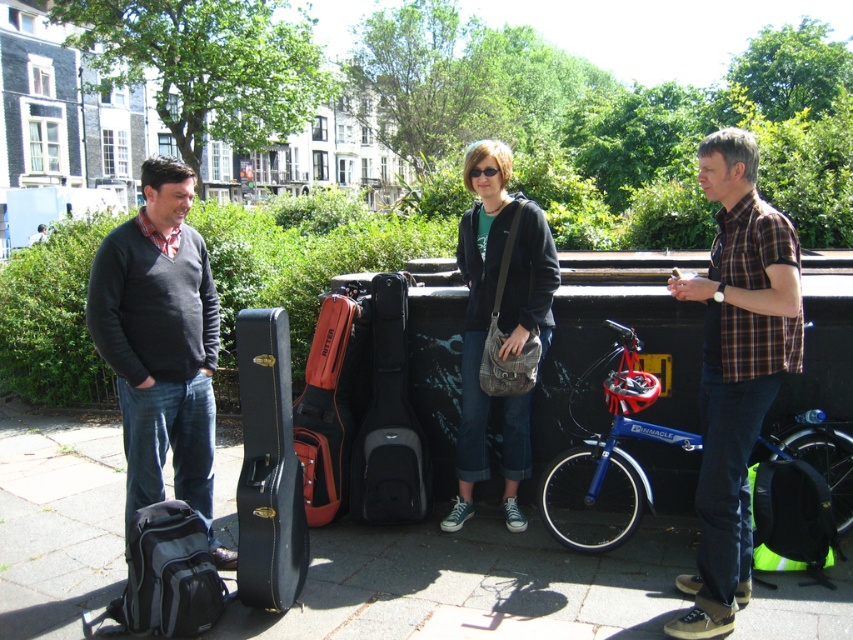
Can you confirm if brown plaid shirt at right is positioned to the right of dark gray sweater at left?

Yes, brown plaid shirt at right is to the right of dark gray sweater at left.

Which is behind, point (701, 436) or point (160, 451)?

Point (701, 436)

I want to click on brown plaid shirt at right, so click(x=735, y=369).

Can you confirm if blue metallic bicycle at right is positioned to the right of orange leather guitar case at center?

Correct, you'll find blue metallic bicycle at right to the right of orange leather guitar case at center.

Does blue metallic bicycle at right appear over orange leather guitar case at center?

Actually, blue metallic bicycle at right is below orange leather guitar case at center.

Consider the image. Measure the distance between point (608,454) and camera.

Point (608,454) is 4.61 meters away from camera.

Find the location of a particular element. blue metallic bicycle at right is located at coordinates 608,461.

Locate an element on the screen. This screenshot has width=853, height=640. dark gray sweater at left is located at coordinates (160, 342).

This screenshot has width=853, height=640. What do you see at coordinates (160, 342) in the screenshot?
I see `dark gray sweater at left` at bounding box center [160, 342].

The height and width of the screenshot is (640, 853). What are the coordinates of `dark gray sweater at left` in the screenshot? It's located at [x=160, y=342].